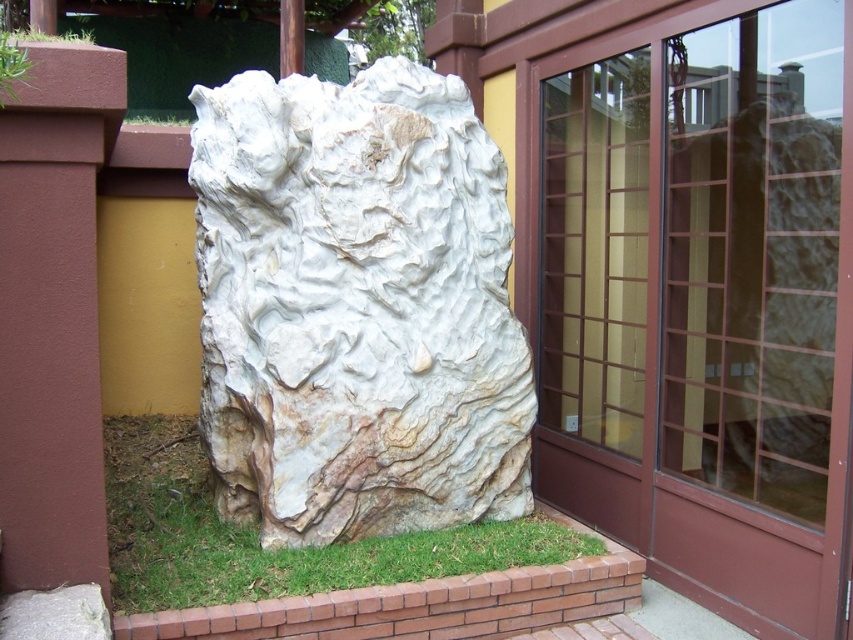
Is transparent glass door at center to the right of green leafy grass at upper left from the viewer's perspective?

Yes, transparent glass door at center is to the right of green leafy grass at upper left.

Between point (782, 154) and point (53, 35), which one is positioned in front?

Point (782, 154) is in front.

Which is behind, point (703, 522) or point (82, 40)?

The point (703, 522) is behind.

You are a GUI agent. You are given a task and a screenshot of the screen. Output one action in this format:
    pyautogui.click(x=<x>, y=<y>)
    Task: Click on the transparent glass door at center
    The width and height of the screenshot is (853, 640).
    Given the screenshot: What is the action you would take?
    pyautogui.click(x=704, y=304)

Does white marble rock at center have a lesser width compared to green leafy grass at upper left?

No, white marble rock at center is not thinner than green leafy grass at upper left.

Between point (373, 428) and point (10, 29), which one is positioned in front?

Point (373, 428)

Locate an element on the screen. This screenshot has width=853, height=640. white marble rock at center is located at coordinates (357, 307).

Does transparent glass door at center appear under green grass at lower left?

No, transparent glass door at center is not below green grass at lower left.

Between point (616, 289) and point (160, 568), which one is positioned in front?

Positioned in front is point (160, 568).

Image resolution: width=853 pixels, height=640 pixels. In order to click on transparent glass door at center in this screenshot , I will do `click(704, 304)`.